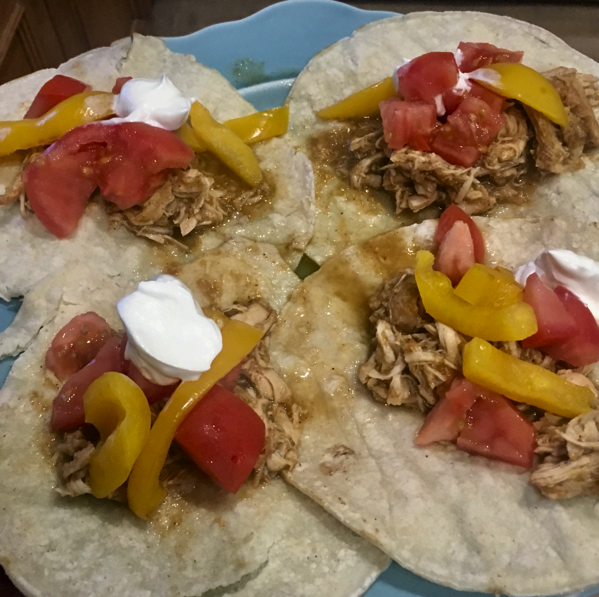
Find the location of a particular element. rim of plate is located at coordinates pos(264,85).